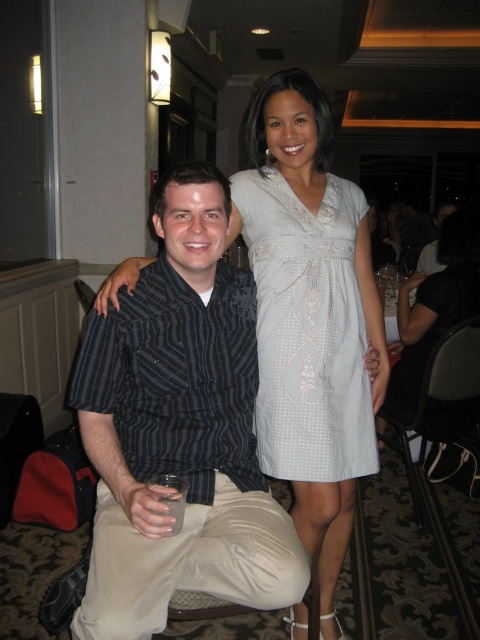
You are taking a photo in a restaurant and want to position two points of interest. The first point is at coordinates point (211, 166) and the second is at point (420, 323). Which point is closer to the camera?

Point (211, 166) is in front of point (420, 323), so it is closer to the camera.

You are a photographer trying to frame two dresses in the center of the image. The light blue fabric dress at center and the white lace dress at center. Which dress should you focus on if you want to capture the larger one?

The white lace dress at center is larger than the light blue fabric dress at center, so you should focus on the white lace dress at center to capture the larger one.

You are a photographer adjusting the camera settings for a group photo. The two dresses in the scene are the light blue fabric dress at center and the white lace dress at center. To ensure both dresses are in focus, what minimum focusing distance should you set?

The light blue fabric dress at center is 1.04 meters away from the white lace dress at center. To ensure both are in focus, the minimum focusing distance should be set to 1.04 meters.